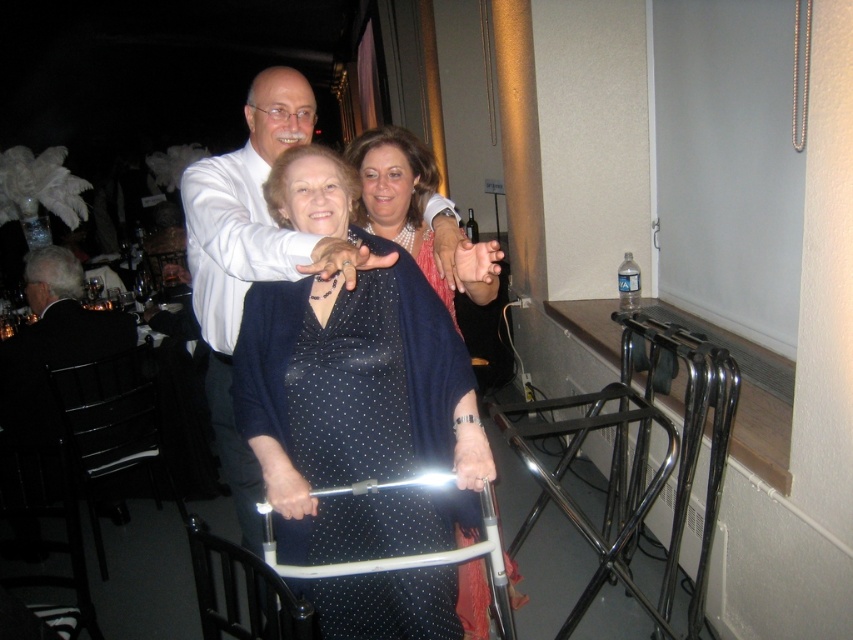
Question: Is polka dot fabric walker at center positioned in front of black leather chair at left?

Choices:
 (A) yes
 (B) no

Answer: (A)

Question: Is polka dot fabric walker at center to the left of black leather chair at left from the viewer's perspective?

Choices:
 (A) no
 (B) yes

Answer: (A)

Question: From the image, what is the correct spatial relationship of polka dot fabric walker at center in relation to black leather chair at left?

Choices:
 (A) right
 (B) left

Answer: (A)

Question: Which point is closer to the camera?

Choices:
 (A) black leather chair at left
 (B) polka dot fabric walker at center

Answer: (B)